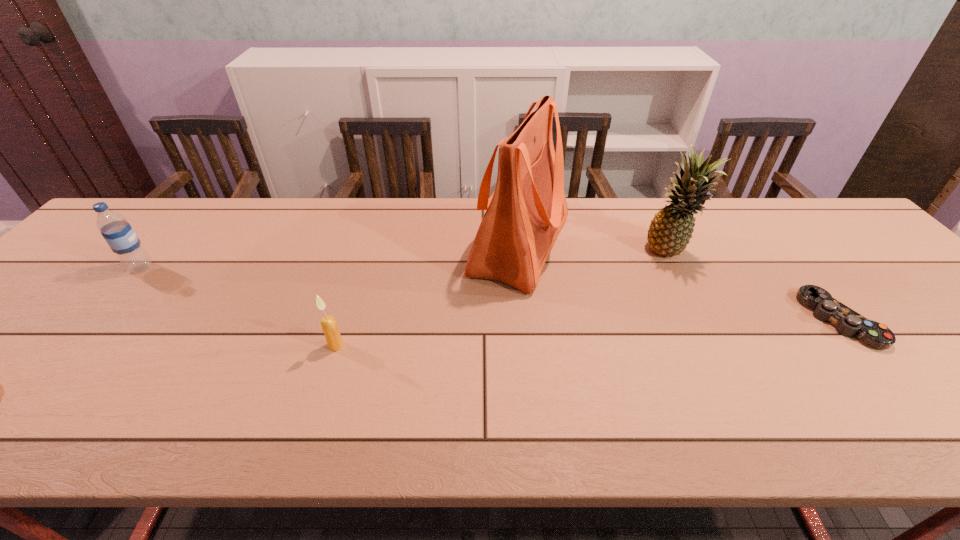
Image resolution: width=960 pixels, height=540 pixels. In order to click on shopping bag in this screenshot , I will do `click(524, 215)`.

The width and height of the screenshot is (960, 540). In order to click on the third object from right to left in this screenshot , I will do `click(524, 215)`.

At what (x,y) coordinates should I click in order to perform the action: click on pineapple. Please return your answer as a coordinate pair (x, y). The height and width of the screenshot is (540, 960). Looking at the image, I should click on (671, 229).

What are the coordinates of `the second object from right to left` in the screenshot? It's located at (671, 229).

You are a GUI agent. You are given a task and a screenshot of the screen. Output one action in this format:
    pyautogui.click(x=<x>, y=<y>)
    Task: Click on the water bottle
    Image resolution: width=960 pixels, height=540 pixels.
    Given the screenshot: What is the action you would take?
    pyautogui.click(x=117, y=232)

You are a GUI agent. You are given a task and a screenshot of the screen. Output one action in this format:
    pyautogui.click(x=<x>, y=<y>)
    Task: Click on the third shortest object
    Image resolution: width=960 pixels, height=540 pixels.
    Given the screenshot: What is the action you would take?
    pyautogui.click(x=117, y=232)

The image size is (960, 540). Find the location of `the fourth object from right to left`. the fourth object from right to left is located at coordinates (329, 325).

I want to click on the fourth tallest object, so coord(329,325).

Where is `the shortest object`? The width and height of the screenshot is (960, 540). the shortest object is located at coordinates (848, 322).

The image size is (960, 540). Find the location of `control`. control is located at coordinates (848, 322).